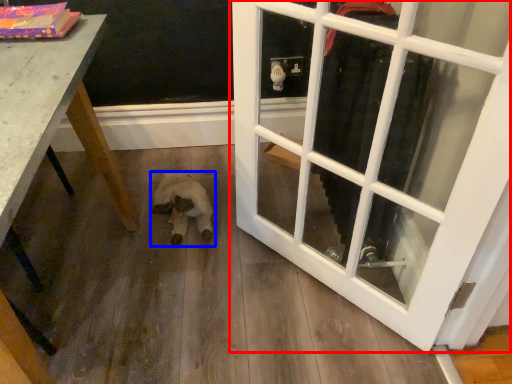
Question: Which of the following is the closest to the observer, door (highlighted by a red box) or animal (highlighted by a blue box)?

Choices:
 (A) door
 (B) animal

Answer: (A)